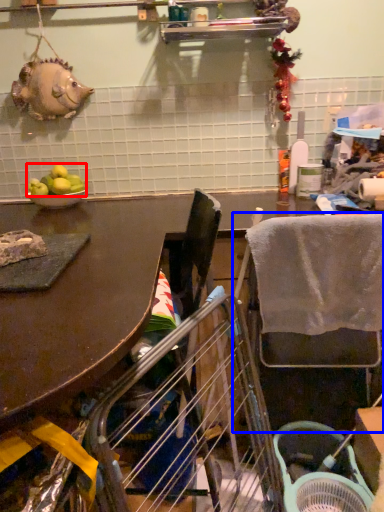
Question: Which point is further to the camera, fruit (highlighted by a red box) or chair (highlighted by a blue box)?

Choices:
 (A) fruit
 (B) chair

Answer: (A)